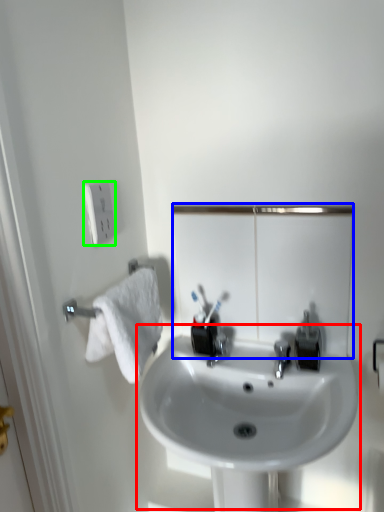
Question: Which object is positioned closest to sink (highlighted by a red box)? Select from mirror (highlighted by a blue box) and electric outlet (highlighted by a green box).

Choices:
 (A) mirror
 (B) electric outlet

Answer: (A)